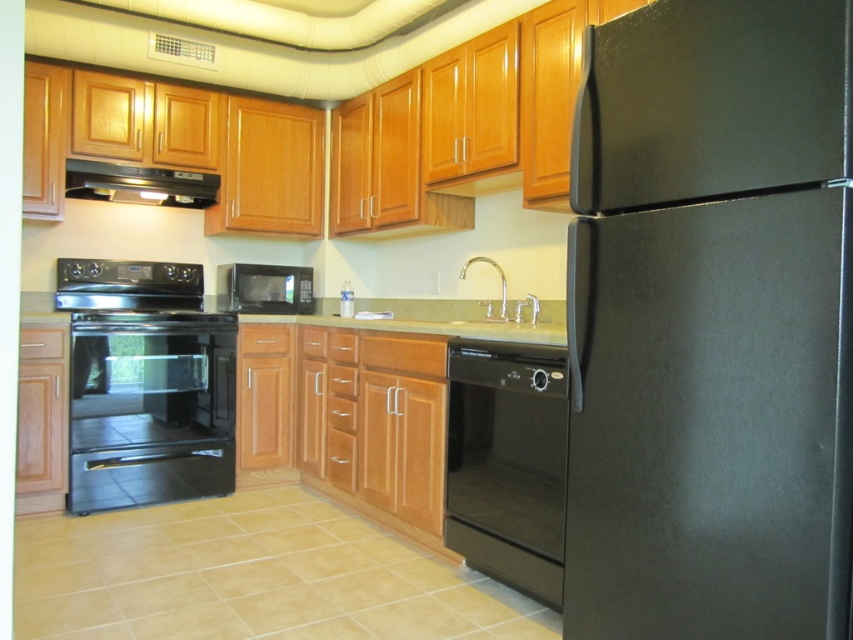
Question: Is black glass oven at lower left bigger than green granite countertop at center?

Choices:
 (A) yes
 (B) no

Answer: (B)

Question: Which of the following is the farthest from the observer?

Choices:
 (A) black glass oven at lower left
 (B) stainless steel oven at left
 (C) black matte microwave at center

Answer: (C)

Question: Where is black glass oven at lower left located in relation to black matte exhaust hood at upper left in the image?

Choices:
 (A) above
 (B) below

Answer: (B)

Question: Which object is the closest to the stainless steel oven at left?

Choices:
 (A) polished chrome faucet at center
 (B) black matte exhaust hood at upper left
 (C) green granite countertop at center
 (D) black glass oven at lower left

Answer: (B)

Question: Which object is positioned farthest from the black matte exhaust hood at upper left?

Choices:
 (A) green granite countertop at center
 (B) black glass oven at lower left

Answer: (A)

Question: Can you confirm if green granite countertop at center is smaller than polished chrome faucet at center?

Choices:
 (A) no
 (B) yes

Answer: (A)